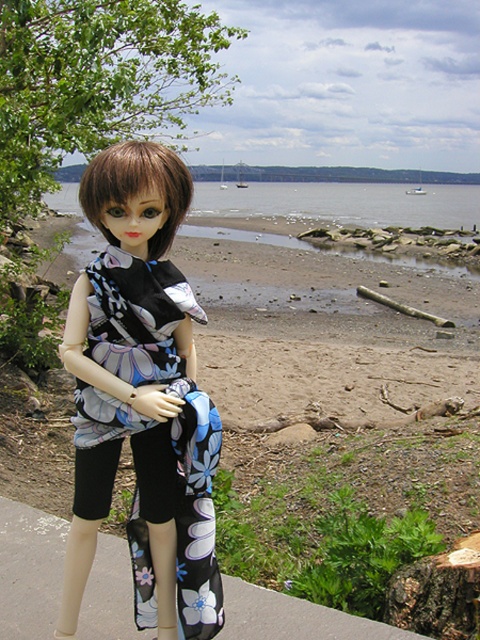
Is the position of floral-patterned fabric dress at center more distant than that of smooth concrete ledge at lower left?

No, it is not.

Is point (103, 161) positioned in front of point (24, 532)?

Yes, it is in front of point (24, 532).

You are a GUI agent. You are given a task and a screenshot of the screen. Output one action in this format:
    pyautogui.click(x=<x>, y=<y>)
    Task: Click on the floral-patterned fabric dress at center
    The height and width of the screenshot is (640, 480).
    Given the screenshot: What is the action you would take?
    pyautogui.click(x=142, y=397)

Does point (276, 600) come in front of point (431, 579)?

No, (276, 600) is further to viewer.

Does smooth concrete ledge at lower left have a lesser height compared to brown wood stump at lower right?

Indeed, smooth concrete ledge at lower left has a lesser height compared to brown wood stump at lower right.

Between point (16, 572) and point (410, 593), which one is positioned in front?

Point (410, 593) is more forward.

Identify the location of smooth concrete ledge at lower left. This screenshot has width=480, height=640. (29, 570).

Which is more to the right, clear water at beach center or brown wood stump at lower right?

clear water at beach center is more to the right.

Is clear water at beach center to the right of brown wood stump at lower right from the viewer's perspective?

Yes, clear water at beach center is to the right of brown wood stump at lower right.

What do you see at coordinates (343, 202) in the screenshot? I see `clear water at beach center` at bounding box center [343, 202].

Image resolution: width=480 pixels, height=640 pixels. I want to click on clear water at beach center, so click(x=343, y=202).